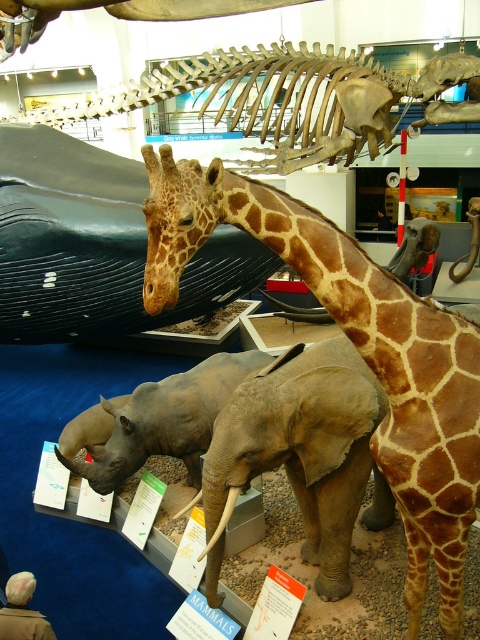
You are a museum visitor standing in front of the exhibit. You notice the brown spotted giraffe at center and the gray matte elephant at center. Which animal is taller?

The brown spotted giraffe at center is much taller than the gray matte elephant at center.

Looking at this image, you are a museum visitor trying to take a photo of both the brown spotted giraffe at center and the gray matte elephant at center. Which one should you zoom in on to capture more details due to its size?

The brown spotted giraffe at center has a larger size compared to the gray matte elephant at center, so you should zoom in on the brown spotted giraffe at center to capture more details because it is bigger.